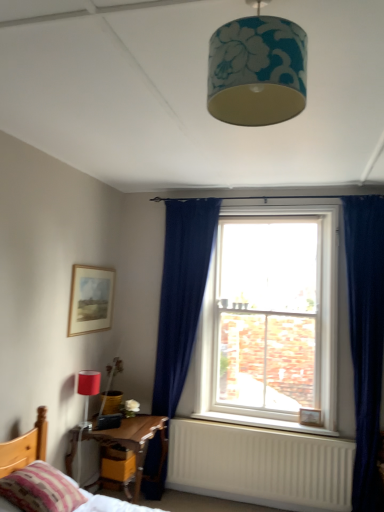
I want to click on free spot above wooden bed at lower left (from a real-world perspective), so click(131, 425).